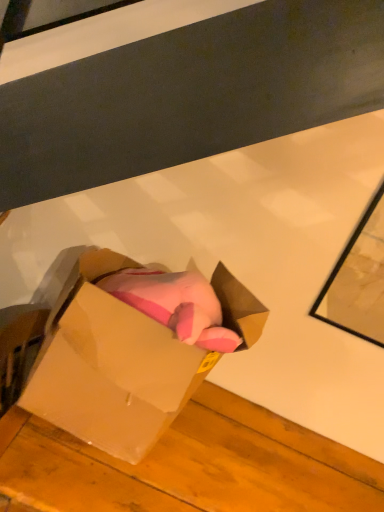
Where is `vacant area that is situated to the right of matte cardboard box at center`? vacant area that is situated to the right of matte cardboard box at center is located at coordinates (242, 451).